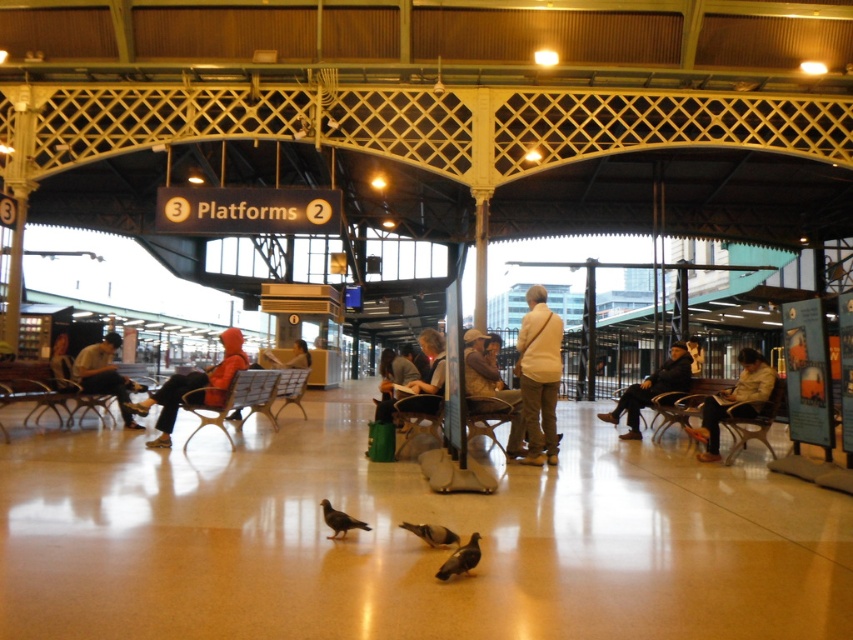
You are a passenger sitting on a bench in the train station waiting area. You notice a light brown leather jacket at center and a gray matte pigeon at lower center. Which object is closer to you?

The light brown leather jacket at center is closer to you because the gray matte pigeon at lower center is behind it.